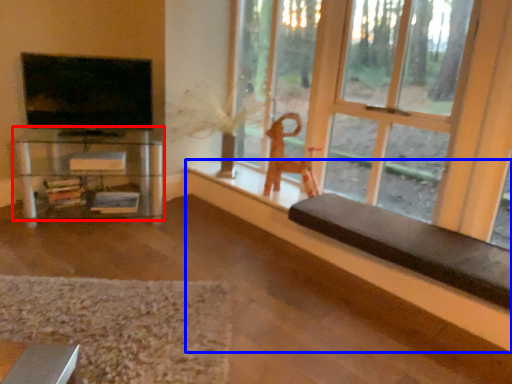
Question: Which of the following is the farthest to the observer, shelf (highlighted by a red box) or ledge (highlighted by a blue box)?

Choices:
 (A) shelf
 (B) ledge

Answer: (A)